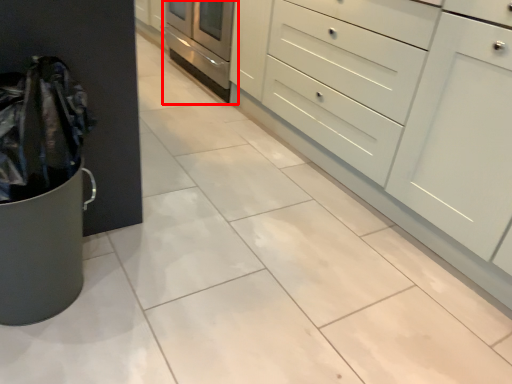
Question: From the image's perspective, considering the relative positions of oven (annotated by the red box) and chest of drawers in the image provided, where is oven (annotated by the red box) located with respect to the staircase?

Choices:
 (A) above
 (B) below

Answer: (A)